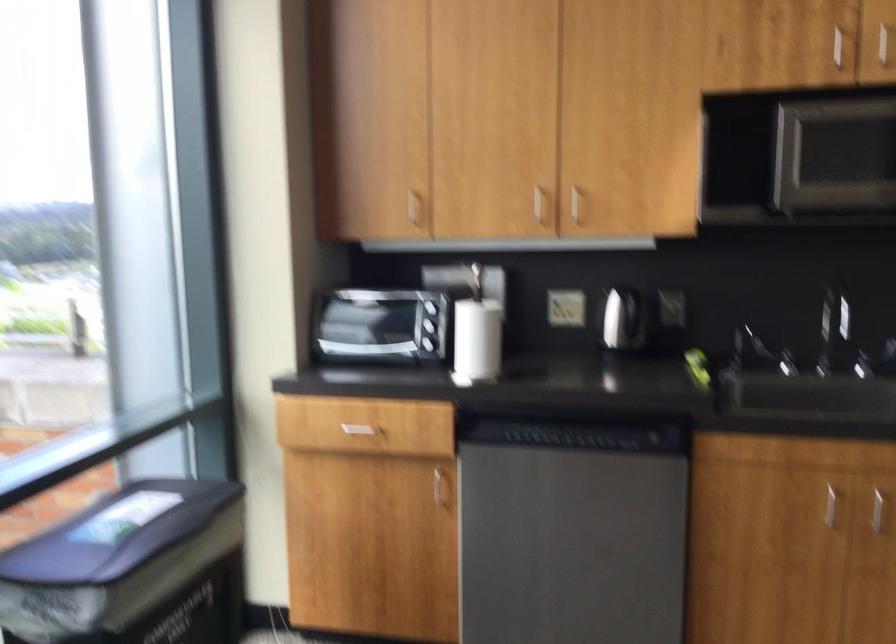
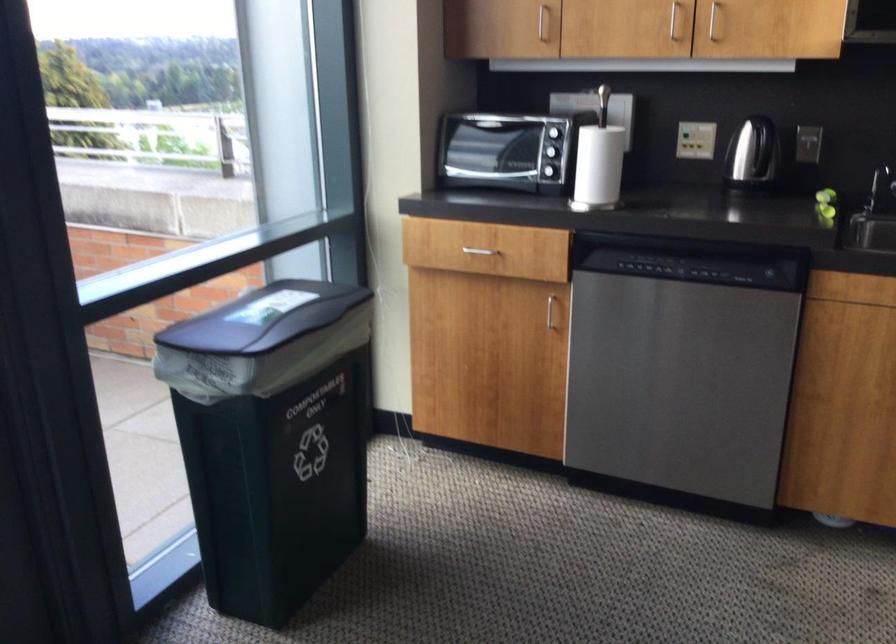
Locate, in the second image, the point that corresponds to (126,527) in the first image.

(262, 319)